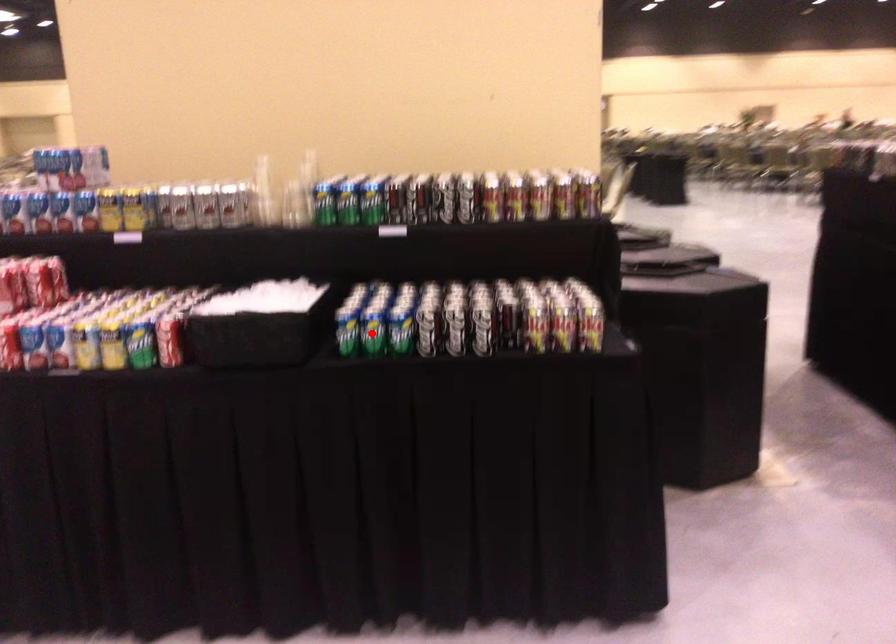
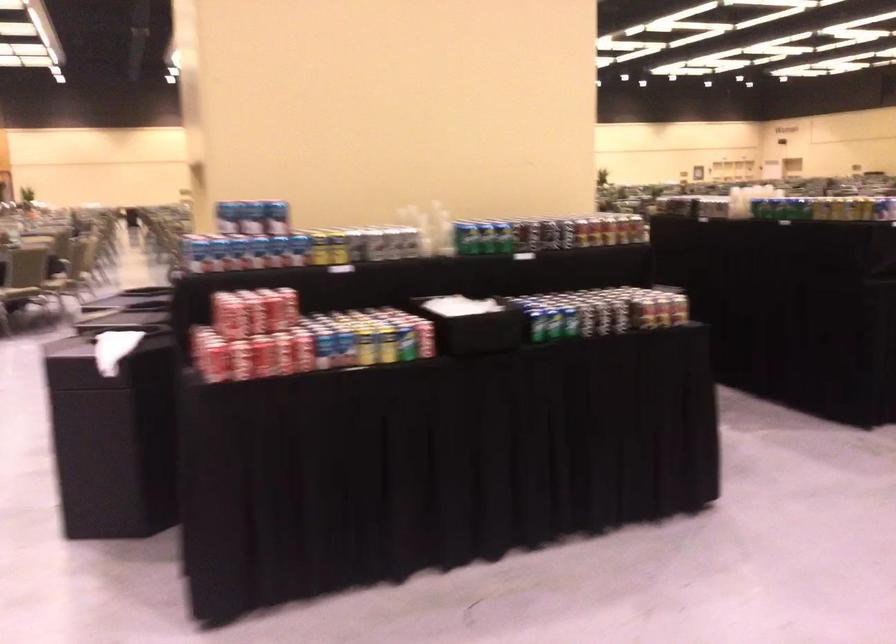
Question: I am providing you with two images of the same scene from different viewpoints. A red point is shown in image1. For the corresponding object point in image2, is it positioned nearer or farther from the camera?

Choices:
 (A) Nearer
 (B) Farther

Answer: (B)